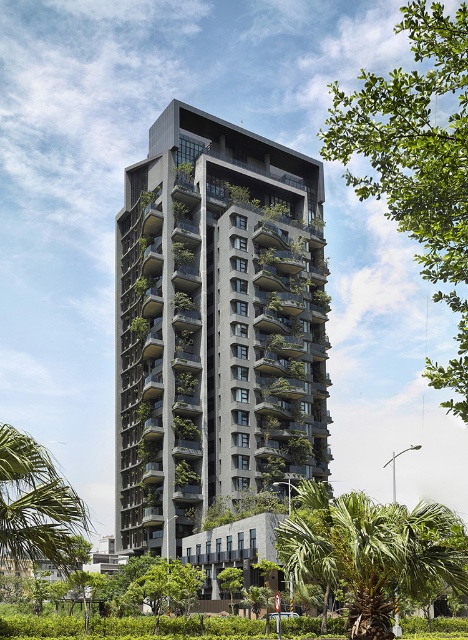
You are standing in a park and want to take a photo of the dark gray concrete building at center. However, you notice the green leafy palm tree at lower right might block your view. Based on the scene description, will the palm tree obstruct the building in your photo?

The green leafy palm tree at lower right is behind the dark gray concrete building at center, so it will not obstruct the building in your photo.

Looking at the dark gray concrete building at center and the green leafy tree at upper right, which one is positioned to the left side of the other?

The dark gray concrete building at center is positioned to the left of the green leafy tree at upper right.